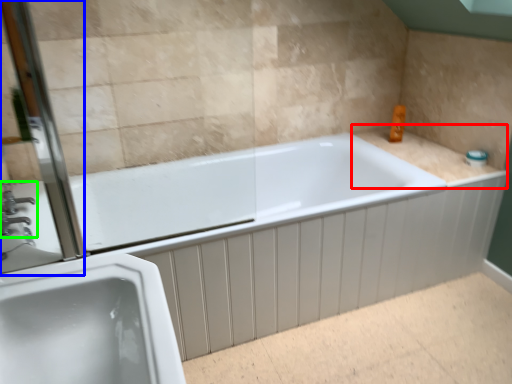
Question: Which is farther away from counter top (highlighted by a red box)? screen door (highlighted by a blue box) or tap (highlighted by a green box)?

Choices:
 (A) screen door
 (B) tap

Answer: (B)